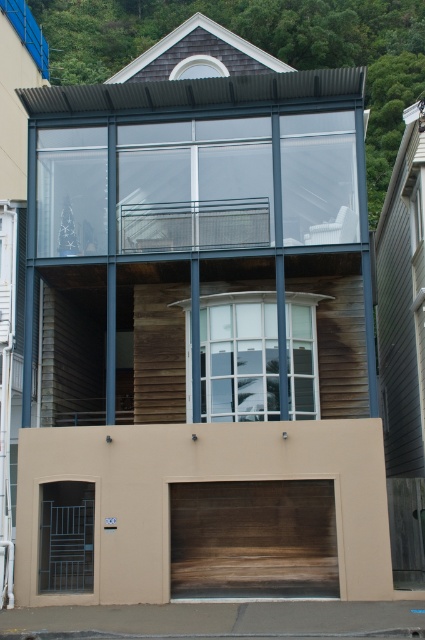
Is brown wood garage door at lower center below wooden garage door at lower center?

Incorrect, brown wood garage door at lower center is not positioned below wooden garage door at lower center.

Does brown wood garage door at lower center have a lesser width compared to wooden garage door at lower center?

Indeed, brown wood garage door at lower center has a lesser width compared to wooden garage door at lower center.

Is point (147, 465) positioned after point (289, 490)?

That is True.

What are the coordinates of `brown wood garage door at lower center` in the screenshot? It's located at (197, 483).